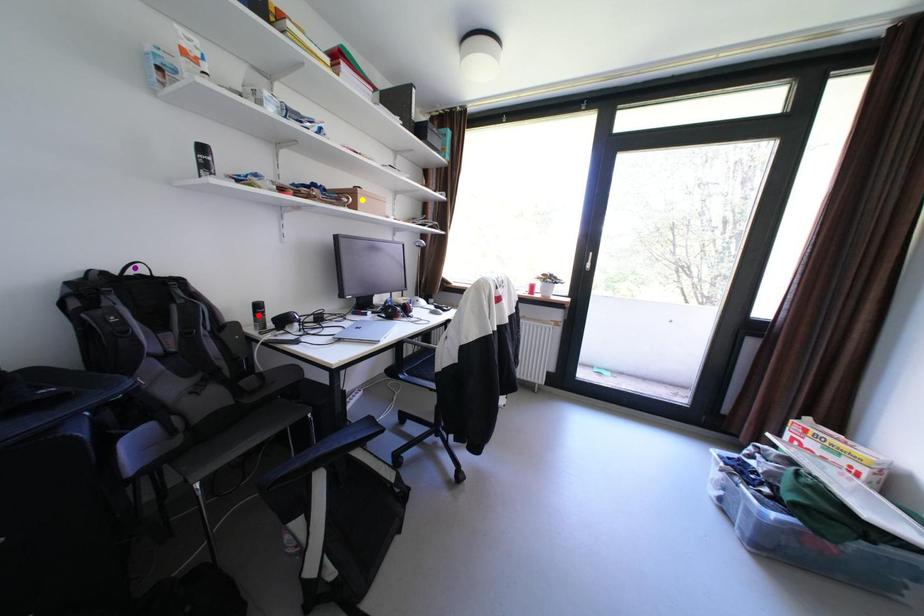
Looking at this image, order these from nearest to farthest:
red point | purple point | yellow point

purple point
red point
yellow point